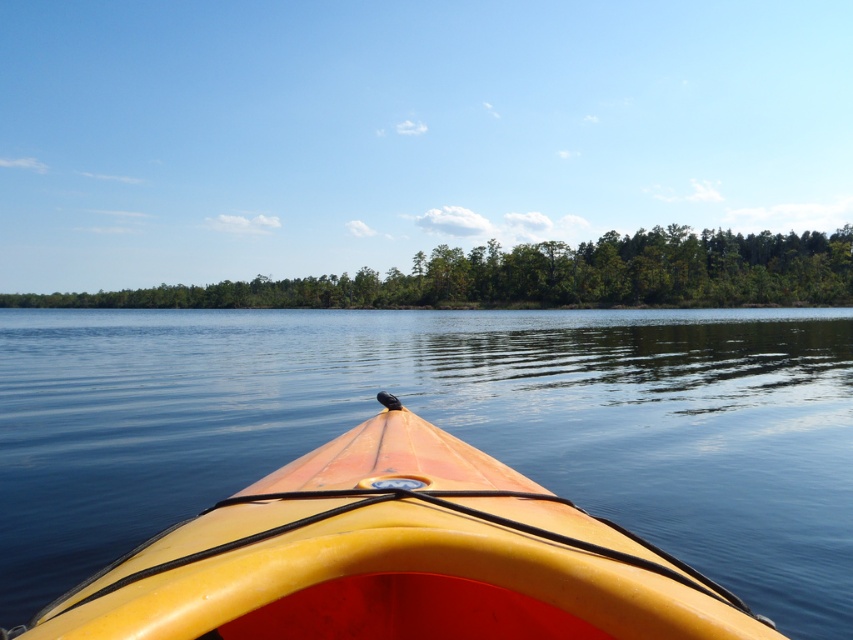
Question: Which point is closer to the camera?

Choices:
 (A) (788, 259)
 (B) (393, 636)

Answer: (B)

Question: Can you confirm if yellow matte kayak at center is wider than green leafy trees at center?

Choices:
 (A) yes
 (B) no

Answer: (B)

Question: Which of the following is the farthest from the observer?

Choices:
 (A) yellow matte kayak at center
 (B) green leafy trees at center

Answer: (B)

Question: Does yellow matte kayak at center have a smaller size compared to green leafy trees at center?

Choices:
 (A) yes
 (B) no

Answer: (A)

Question: From the image, what is the correct spatial relationship of yellow matte kayak at center in relation to green leafy trees at center?

Choices:
 (A) below
 (B) above

Answer: (A)